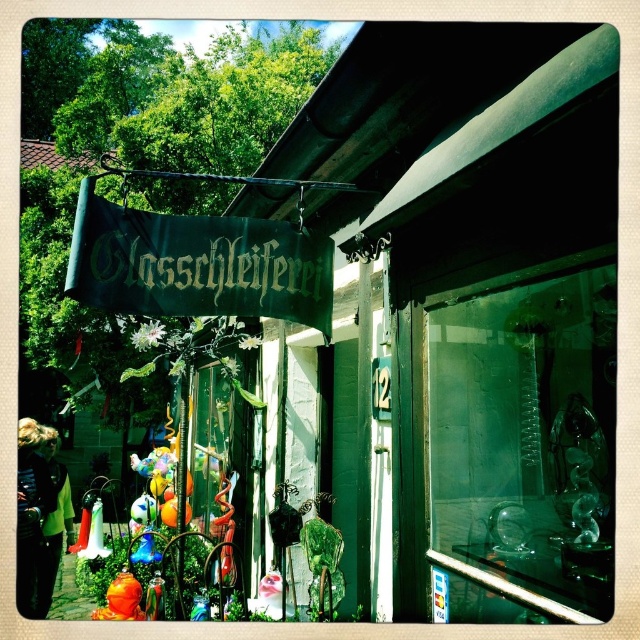
You are standing in front of the Glasschleiferei storefront and notice two points marked on the image. The first point is at coordinates point (x=550, y=365) and the second is at point (x=298, y=268). Which point is closer to you?

Point (x=550, y=365) is closer to the camera than point (x=298, y=268).

You are a customer standing in front of the Glasschleiferei storefront. You see the transparent glass sculpture at center and the green fabric sign at upper center. Which object is closer to you?

The transparent glass sculpture at center is closer to you because it is in front of the green fabric sign at upper center.